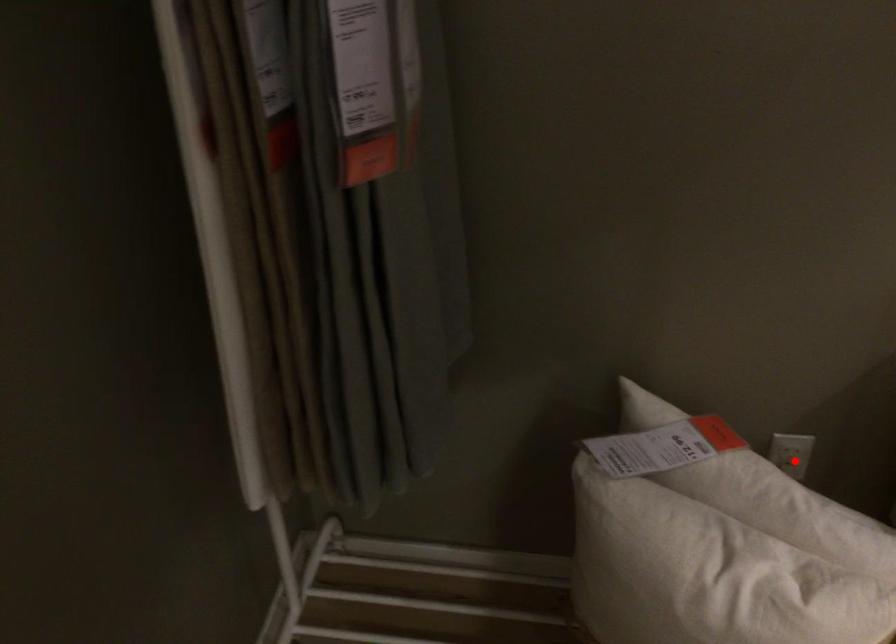
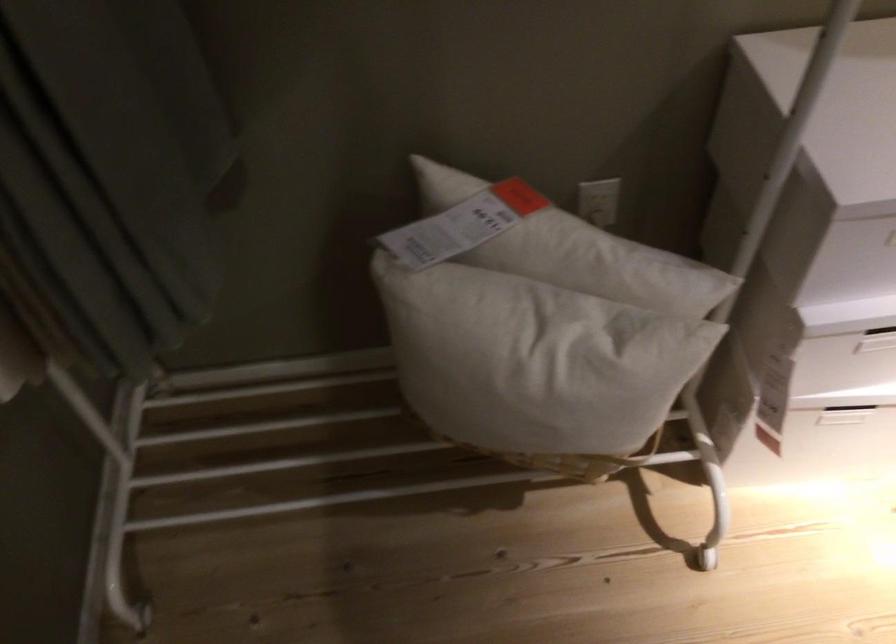
In the second image, find the point that corresponds to the highlighted location in the first image.

(598, 207)